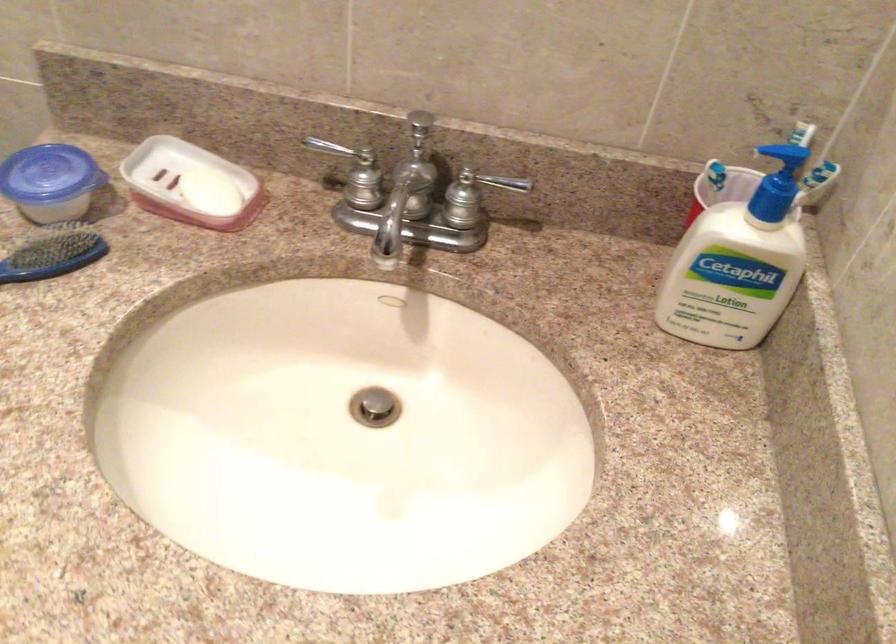
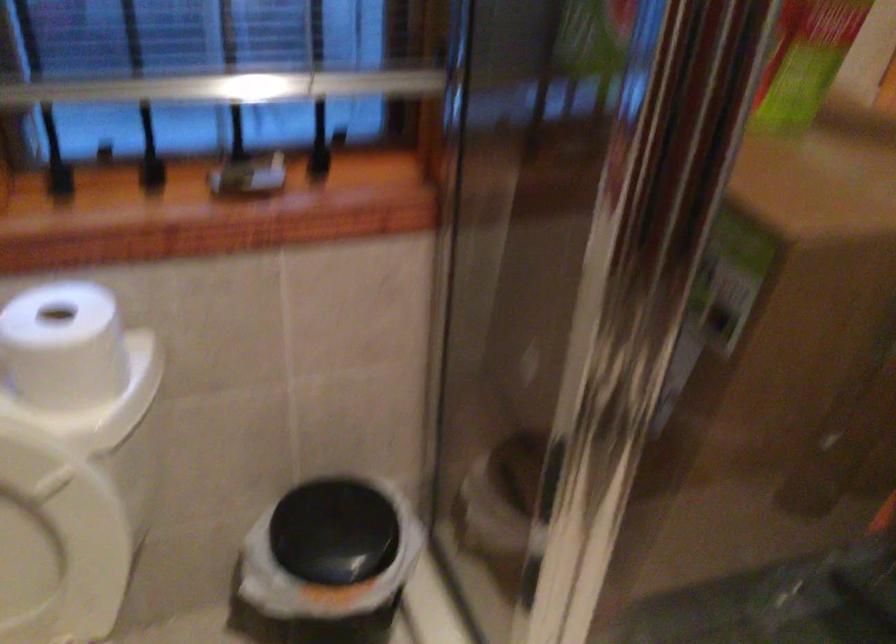
Question: The images are taken continuously from a first-person perspective. In which direction is your viewpoint rotating?

Choices:
 (A) Left
 (B) Right
 (C) Up
 (D) Down

Answer: (A)